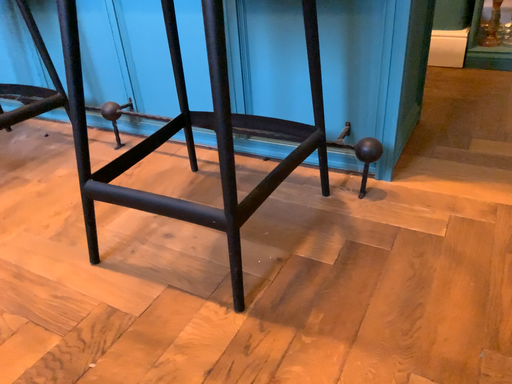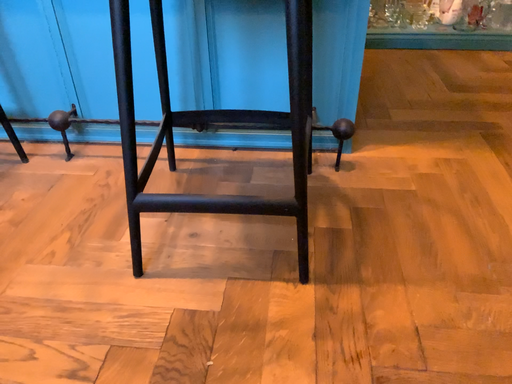
Question: How did the camera likely rotate when shooting the video?

Choices:
 (A) rotated right
 (B) rotated left

Answer: (A)